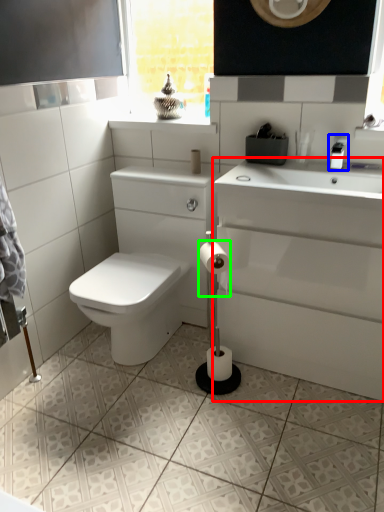
Question: Considering the real-world distances, which object is closest to porcelain (highlighted by a red box)? faucet (highlighted by a blue box) or toilet paper (highlighted by a green box).

Choices:
 (A) faucet
 (B) toilet paper

Answer: (B)